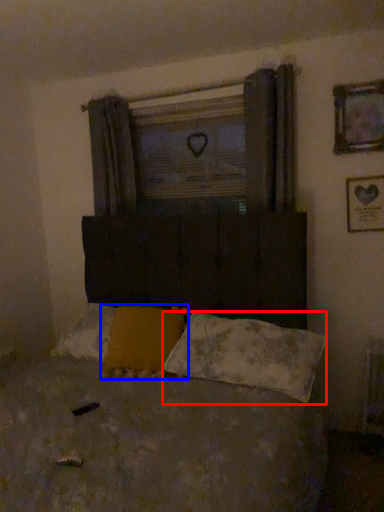
Question: Which of the following is the closest to the observer, pillow (highlighted by a red box) or pillow (highlighted by a blue box)?

Choices:
 (A) pillow
 (B) pillow

Answer: (A)